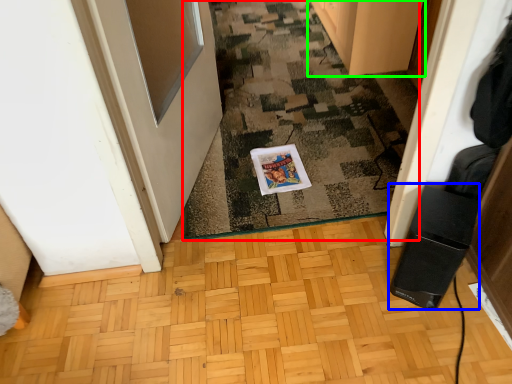
Question: Which object is positioned farthest from doormat (highlighted by a red box)? Select from appliance (highlighted by a blue box) and cabinetry (highlighted by a green box).

Choices:
 (A) appliance
 (B) cabinetry

Answer: (A)